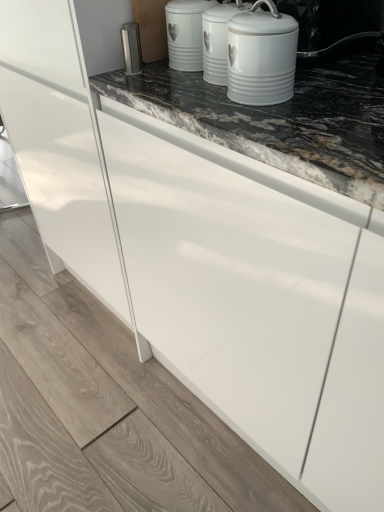
What do you see at coordinates (131, 48) in the screenshot? I see `satin silver canister at upper center` at bounding box center [131, 48].

What is the approximate height of white ceramic canister at upper center?

6.35 inches.

Find the location of a particular element. The height and width of the screenshot is (512, 384). satin silver canister at upper center is located at coordinates 131,48.

Is satin silver canister at upper center inside or outside of white ceramic canister at upper center?

satin silver canister at upper center is not enclosed by white ceramic canister at upper center.

How far apart are satin silver canister at upper center and white ceramic canister at upper center?

The distance of satin silver canister at upper center from white ceramic canister at upper center is 10.41 inches.

Does satin silver canister at upper center have a smaller size compared to white ceramic canister at upper center?

Yes, satin silver canister at upper center is smaller than white ceramic canister at upper center.

Is white ceramic canister at upper center positioned with its back to white ceramic canister at upper center?

No, white ceramic canister at upper center is not facing away from white ceramic canister at upper center.

Is white ceramic canister at upper center shorter than white ceramic canister at upper center?

No, white ceramic canister at upper center is not shorter than white ceramic canister at upper center.

Is white ceramic canister at upper center a part of white ceramic canister at upper center?

No.

Is point (244, 50) more distant than point (198, 0)?

No, (244, 50) is in front of (198, 0).

From a real-world perspective, which is physically below, satin silver canister at upper center or white ceramic canister at upper center?

satin silver canister at upper center.

Is satin silver canister at upper center taller than white ceramic canister at upper center?

No, satin silver canister at upper center is not taller than white ceramic canister at upper center.

Find the location of a particular element. The image size is (384, 512). appliance below the white ceramic canister at upper center (from the image's perspective) is located at coordinates (131, 48).

Is satin silver canister at upper center oriented towards white ceramic canister at upper center?

No.

Considering the relative positions of white ceramic canister at upper center and white ceramic canister at upper center in the image provided, is white ceramic canister at upper center to the right of white ceramic canister at upper center from the viewer's perspective?

Incorrect, white ceramic canister at upper center is not on the right side of white ceramic canister at upper center.

I want to click on kitchen appliance above the white ceramic canister at upper center (from the image's perspective), so coord(186,33).

How many degrees apart are the facing directions of white ceramic canister at upper center and white ceramic canister at upper center?

0 degrees.

In terms of size, does white ceramic canister at upper center appear bigger or smaller than white ceramic canister at upper center?

In the image, white ceramic canister at upper center appears to be larger than white ceramic canister at upper center.

Which is behind, white ceramic canister at upper center or satin silver canister at upper center?

Positioned behind is satin silver canister at upper center.

Is white ceramic canister at upper center looking in the opposite direction of satin silver canister at upper center?

No, white ceramic canister at upper center is not facing the opposite direction of satin silver canister at upper center.

Locate an element on the screen. appliance above the white ceramic canister at upper center (from the image's perspective) is located at coordinates (131, 48).

From a real-world perspective, is white ceramic canister at upper center on top of satin silver canister at upper center?

Yes, from a real-world perspective, white ceramic canister at upper center is on top of satin silver canister at upper center.

Is white ceramic canister at upper center looking in the opposite direction of satin silver canister at upper center?

No.

Can you tell me how much white ceramic canister at upper center and satin silver canister at upper center differ in facing direction?

The facing directions of white ceramic canister at upper center and satin silver canister at upper center are 1.24 degrees apart.

Is white ceramic canister at upper center smaller than satin silver canister at upper center?

Incorrect, white ceramic canister at upper center is not smaller in size than satin silver canister at upper center.

Is point (188, 59) in front of point (137, 42)?

No, it is not.

This screenshot has height=512, width=384. Find the location of `appliance that appears below the white ceramic canister at upper center (from a real-world perspective)`. appliance that appears below the white ceramic canister at upper center (from a real-world perspective) is located at coordinates point(131,48).

The width and height of the screenshot is (384, 512). What are the coordinates of `kitchen appliance lying behind the white ceramic canister at upper center` in the screenshot? It's located at (186, 33).

From the image, which object appears to be nearer to white ceramic canister at upper center, satin silver canister at upper center or white ceramic canister at upper center?

white ceramic canister at upper center lies closer to white ceramic canister at upper center than the other object.

Considering their positions, is satin silver canister at upper center positioned closer to white ceramic canister at upper center than white ceramic canister at upper center?

satin silver canister at upper center is closer to white ceramic canister at upper center.

Based on their spatial positions, is white ceramic canister at upper center or white ceramic canister at upper center further from satin silver canister at upper center?

white ceramic canister at upper center.

Considering their positions, is white ceramic canister at upper center positioned further to satin silver canister at upper center than white ceramic canister at upper center?

The object further to satin silver canister at upper center is white ceramic canister at upper center.

When comparing their distances from white ceramic canister at upper center, does white ceramic canister at upper center or satin silver canister at upper center seem further?

satin silver canister at upper center is positioned further to the anchor white ceramic canister at upper center.

Estimate the real-world distances between objects in this image. Which object is closer to white ceramic canister at upper center, white ceramic canister at upper center or satin silver canister at upper center?

satin silver canister at upper center.

This screenshot has height=512, width=384. What are the coordinates of `kitchen appliance between satin silver canister at upper center and white ceramic canister at upper center` in the screenshot? It's located at (186, 33).